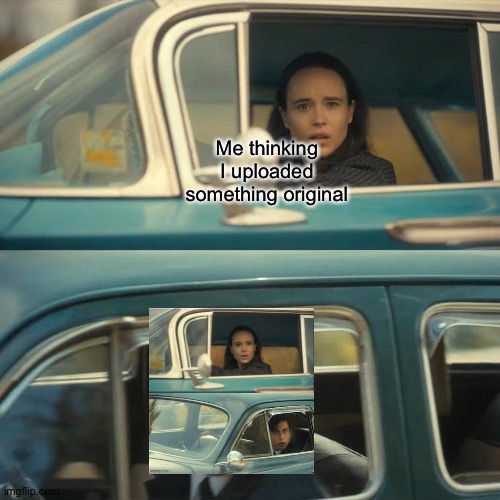
Identify the location of side window. The image size is (500, 500). (80, 145), (200, 343), (157, 354), (252, 448), (482, 477), (491, 58), (201, 101).